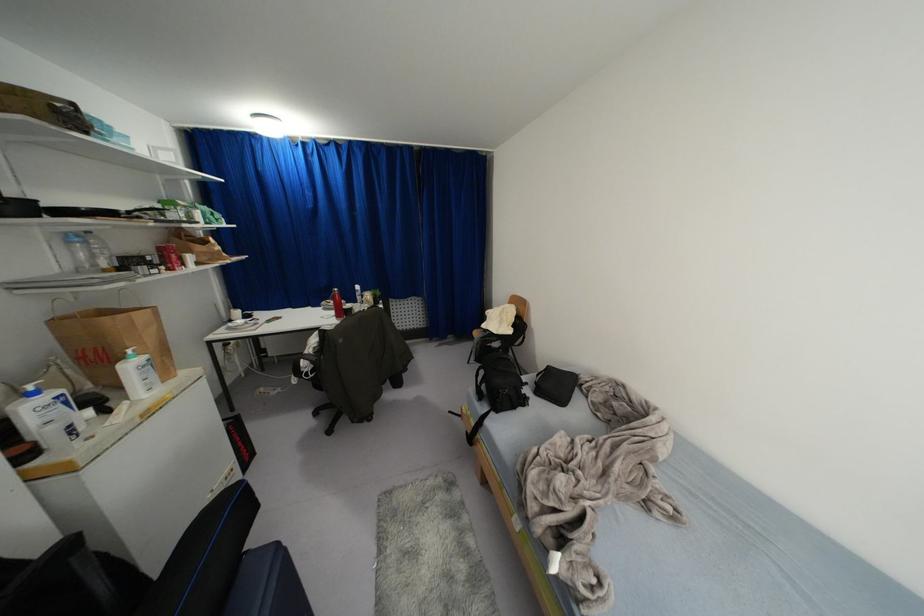
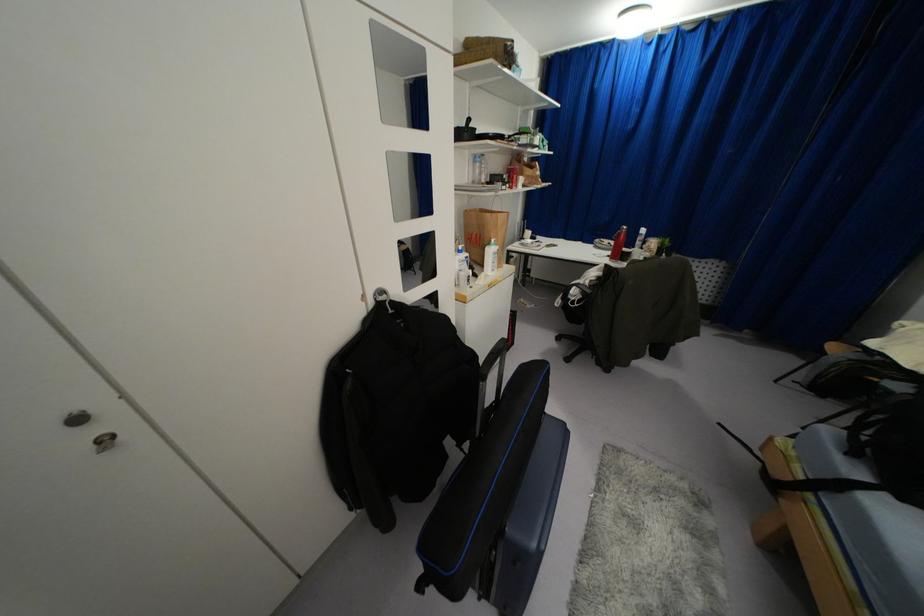
Find the pixel in the second image that matches (x=334, y=294) in the first image.

(618, 233)